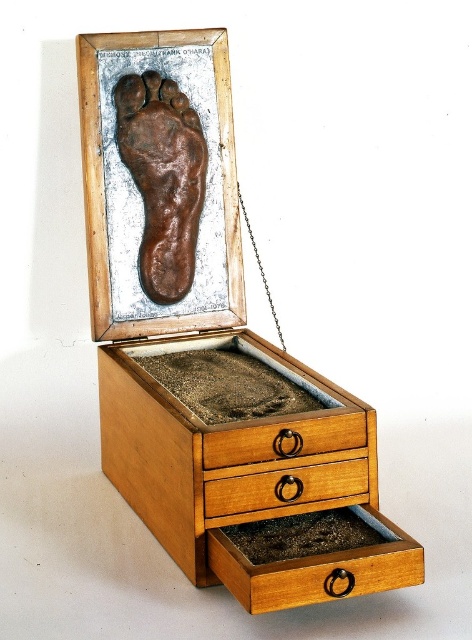
Question: Among these points, which one is farthest from the camera?

Choices:
 (A) (180, 508)
 (B) (288, 476)

Answer: (A)

Question: Does wooden drawer at center have a larger size compared to light brown wood drawer at center?

Choices:
 (A) no
 (B) yes

Answer: (B)

Question: Which object is farther from the camera taking this photo?

Choices:
 (A) light brown wood drawer at center
 (B) brown clay foot at center
 (C) wooden drawer at center

Answer: (B)

Question: Does brown clay foot at center appear on the left side of light brown wood drawer at center?

Choices:
 (A) no
 (B) yes

Answer: (B)

Question: Is wooden drawer at center wider than brown clay foot at center?

Choices:
 (A) yes
 (B) no

Answer: (A)

Question: Which point is closer to the camera?

Choices:
 (A) brown clay foot at center
 (B) light brown wood drawer at center

Answer: (B)